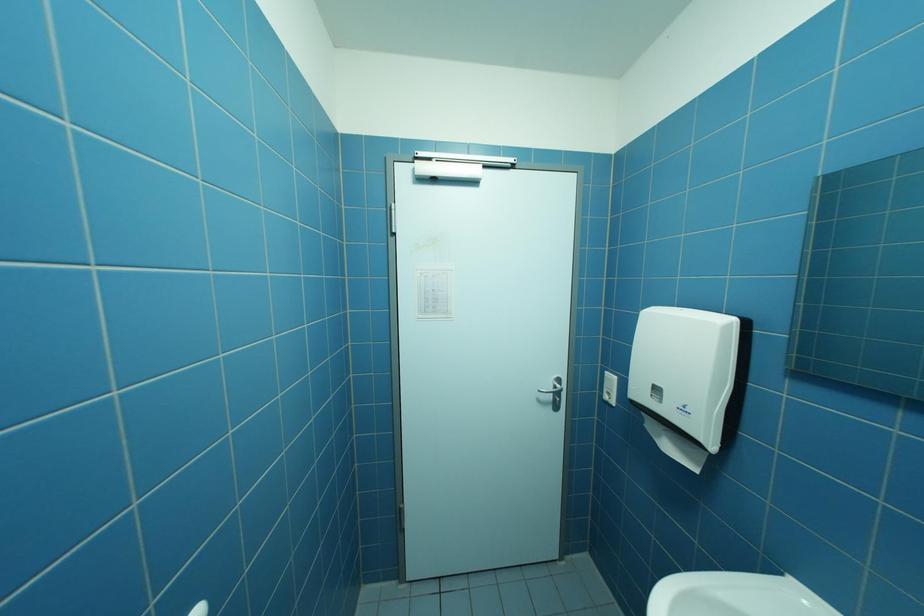
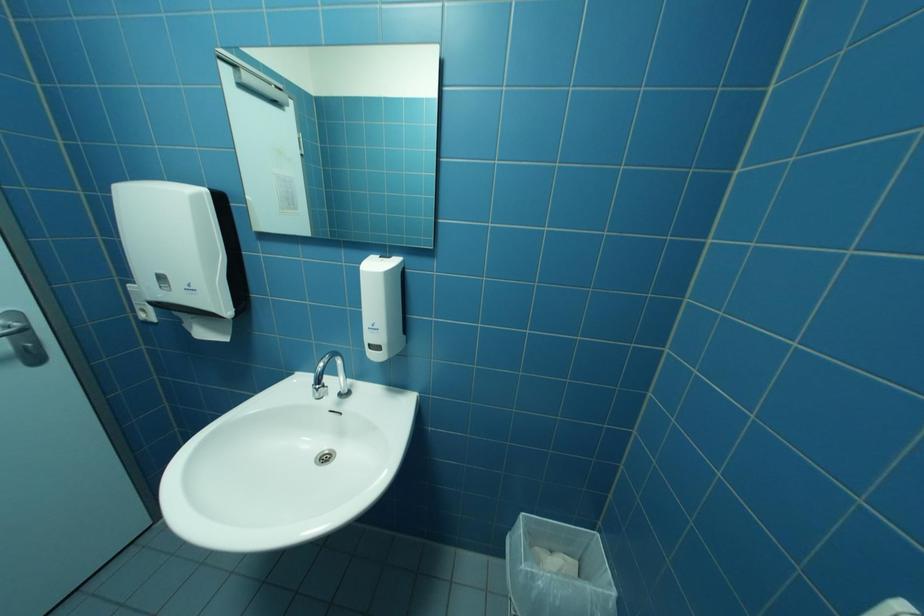
The images are taken continuously from a first-person perspective. In which direction is your viewpoint rotating?

The camera's rotation is toward right-down.